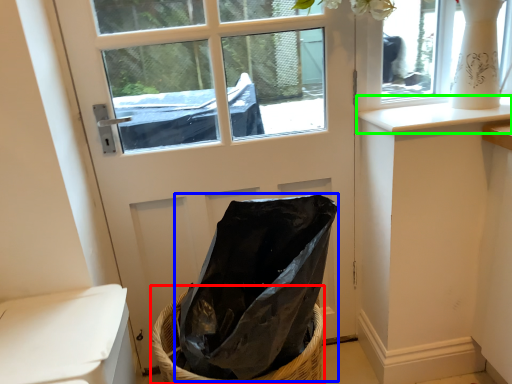
Question: Estimate the real-world distances between objects in this image. Which object is closer to basket (highlighted by a red box), bag (highlighted by a blue box) or window sill (highlighted by a green box)?

Choices:
 (A) bag
 (B) window sill

Answer: (A)